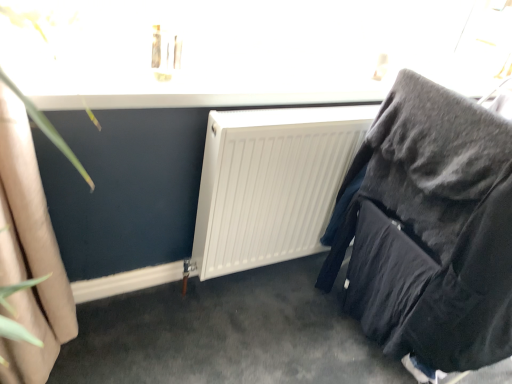
What do you see at coordinates (271, 183) in the screenshot?
I see `white plastic radiator at center` at bounding box center [271, 183].

At what (x,y) coordinates should I click in order to perform the action: click on white plastic radiator at center. Please return your answer as a coordinate pair (x, y). The width and height of the screenshot is (512, 384). Looking at the image, I should click on (271, 183).

The image size is (512, 384). Describe the element at coordinates (431, 229) in the screenshot. I see `velvet black chair at right` at that location.

Measure the distance between velvet black chair at right and camera.

The depth of velvet black chair at right is 93.72 centimeters.

Image resolution: width=512 pixels, height=384 pixels. I want to click on velvet black chair at right, so click(431, 229).

This screenshot has width=512, height=384. I want to click on white plastic radiator at center, so click(x=271, y=183).

In the image, is white plastic radiator at center on the left side or the right side of velvet black chair at right?

From the image, it's evident that white plastic radiator at center is to the left of velvet black chair at right.

Considering their positions, is white plastic radiator at center located in front of or behind velvet black chair at right?

Visually, white plastic radiator at center is located behind velvet black chair at right.

Considering the points (268, 228) and (381, 232), which point is behind, point (268, 228) or point (381, 232)?

The point (268, 228) is more distant.

From the image's perspective, between white plastic radiator at center and velvet black chair at right, who is located below?

From the image's view, velvet black chair at right is below.

From a real-world perspective, does white plastic radiator at center sit lower than velvet black chair at right?

Correct, in the physical world, white plastic radiator at center is lower than velvet black chair at right.

Considering the sizes of objects white plastic radiator at center and velvet black chair at right in the image provided, who is wider, white plastic radiator at center or velvet black chair at right?

With larger width is velvet black chair at right.

Which of these two, white plastic radiator at center or velvet black chair at right, stands taller?

velvet black chair at right.

Who is bigger, white plastic radiator at center or velvet black chair at right?

Bigger between the two is velvet black chair at right.

Is white plastic radiator at center not within velvet black chair at right?

white plastic radiator at center is positioned outside velvet black chair at right.

Is white plastic radiator at center beside velvet black chair at right?

No, white plastic radiator at center is not touching velvet black chair at right.

Is velvet black chair at right at the back of white plastic radiator at center?

Yes, white plastic radiator at center is facing away from velvet black chair at right.

How many degrees apart are the facing directions of white plastic radiator at center and velvet black chair at right?

The facing directions of white plastic radiator at center and velvet black chair at right are 2.27 degrees apart.

Locate an element on the screen. The height and width of the screenshot is (384, 512). furniture that appears above the white plastic radiator at center (from a real-world perspective) is located at coordinates (431, 229).

Is velvet black chair at right at the left side of white plastic radiator at center?

No, velvet black chair at right is not to the left of white plastic radiator at center.

Consider the image. Does velvet black chair at right lie in front of white plastic radiator at center?

Yes, the depth of velvet black chair at right is less than that of white plastic radiator at center.

Between point (485, 116) and point (243, 120), which one is positioned in front?

Point (485, 116)

From the image's perspective, is velvet black chair at right beneath white plastic radiator at center?

Correct, velvet black chair at right appears lower than white plastic radiator at center in the image.

From a real-world perspective, is velvet black chair at right below white plastic radiator at center?

No, from a real-world perspective, velvet black chair at right is not beneath white plastic radiator at center.

Between velvet black chair at right and white plastic radiator at center, which one has larger width?

velvet black chair at right.

Is velvet black chair at right taller than white plastic radiator at center?

Correct, velvet black chair at right is much taller as white plastic radiator at center.

Between velvet black chair at right and white plastic radiator at center, which one has larger size?

velvet black chair at right.

Does velvet black chair at right contain white plastic radiator at center?

No, white plastic radiator at center is located outside of velvet black chair at right.

Is velvet black chair at right in contact with white plastic radiator at center?

No, velvet black chair at right is not with white plastic radiator at center.

Is velvet black chair at right positioned with its back to white plastic radiator at center?

Correct, velvet black chair at right is looking away from white plastic radiator at center.

What's the angular difference between velvet black chair at right and white plastic radiator at center's facing directions?

The angle between the facing direction of velvet black chair at right and the facing direction of white plastic radiator at center is 2.27 degrees.

Where is `radiator that is on the left side of velvet black chair at right`? radiator that is on the left side of velvet black chair at right is located at coordinates (271, 183).

Identify the location of radiator on the left of velvet black chair at right. This screenshot has width=512, height=384. (271, 183).

Locate an element on the screen. This screenshot has height=384, width=512. furniture that appears in front of the white plastic radiator at center is located at coordinates (431, 229).